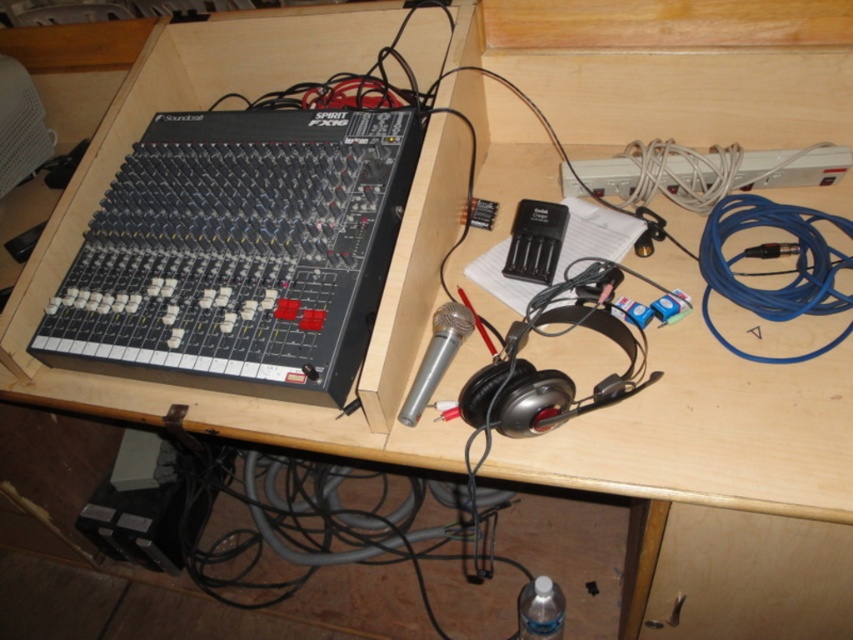
Between wooden drawer at lower right and silver metallic microphone at center, which one is positioned lower?

wooden drawer at lower right is below.

Who is more forward, (851, 634) or (416, 376)?

Point (416, 376)

Find the location of a particular element. wooden drawer at lower right is located at coordinates (738, 573).

Is blue cable at right below silver metallic microphone at center?

No, blue cable at right is not below silver metallic microphone at center.

Can you confirm if blue cable at right is taller than silver metallic microphone at center?

Yes, blue cable at right is taller than silver metallic microphone at center.

Is point (820, 212) farther from camera compared to point (457, 307)?

Yes, it is behind point (457, 307).

You are a GUI agent. You are given a task and a screenshot of the screen. Output one action in this format:
    pyautogui.click(x=<x>, y=<y>)
    Task: Click on the blue cable at right
    Image resolution: width=853 pixels, height=640 pixels.
    Given the screenshot: What is the action you would take?
    pyautogui.click(x=793, y=269)

In the scene shown: Is wooden drawer at lower right below blue cable at right?

Correct, wooden drawer at lower right is located below blue cable at right.

Does wooden drawer at lower right have a smaller size compared to blue cable at right?

No, wooden drawer at lower right is not smaller than blue cable at right.

The width and height of the screenshot is (853, 640). Identify the location of wooden drawer at lower right. (738, 573).